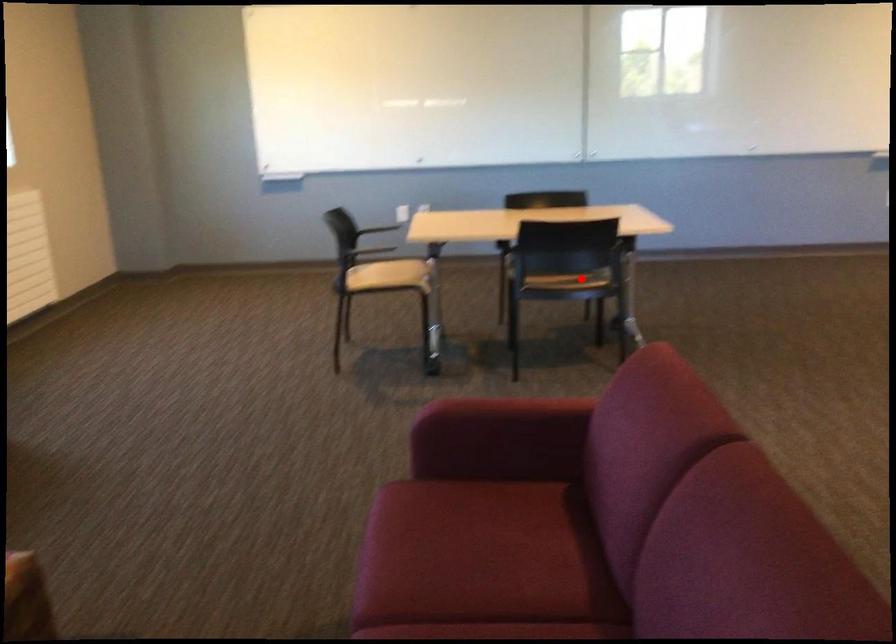
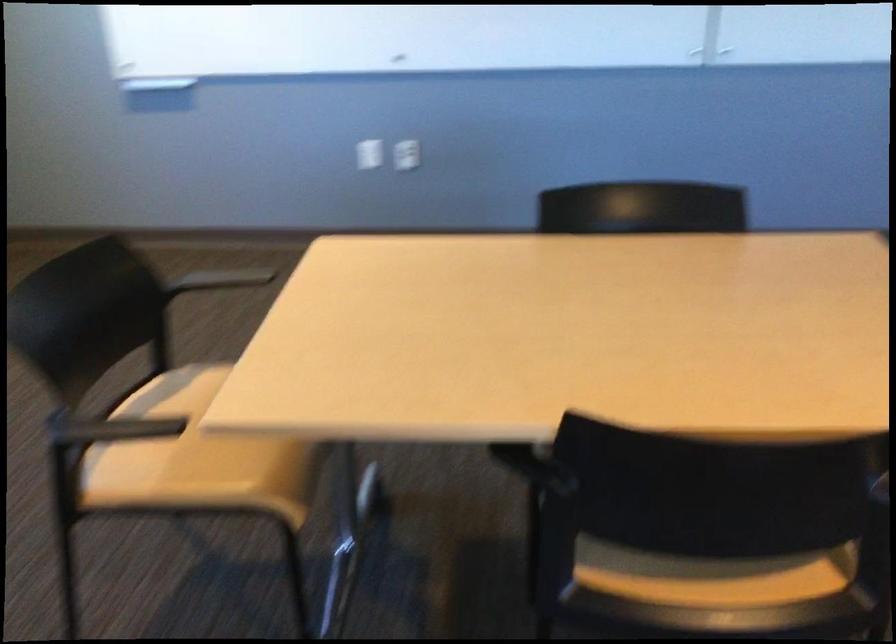
In the second image, find the point that corresponds to the highlighted location in the first image.

(711, 576)